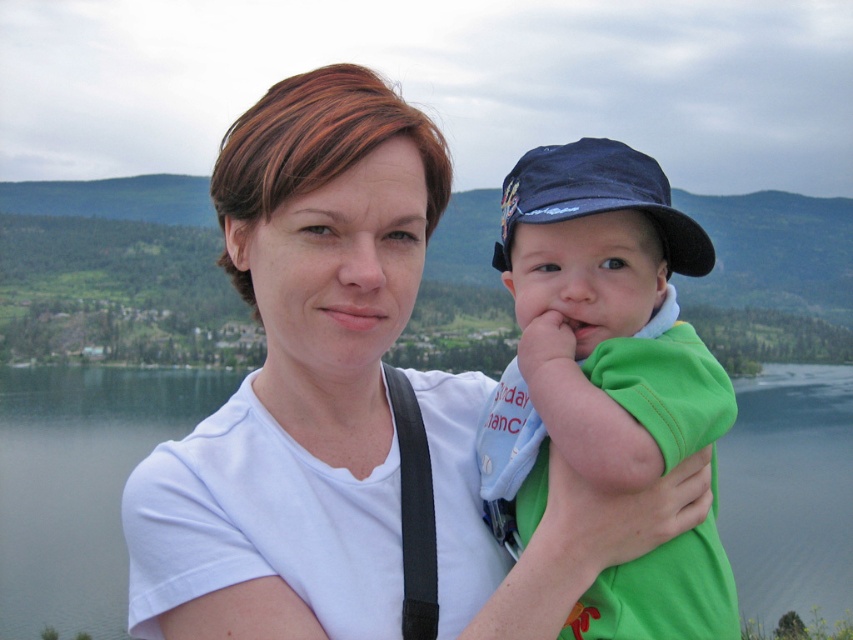
You are organizing a clothing donation drive and need to sort shirts by size. You have a white cotton shirt at center and a green cotton shirt at center. Which shirt should you place in the large size bin?

The white cotton shirt at center should be placed in the large size bin because it is bigger than the green cotton shirt at center.

You are a photographer trying to capture a clear shot of the dark blue fabric baseball cap at center without the transparent water at center obstructing the view. Is this possible given their positions?

The dark blue fabric baseball cap at center is behind transparent water at center, so it might still be visible but could appear slightly blurred or distorted through the water.

You are planning to take a photo of the transparent water at center and the dark blue fabric baseball cap at center. Which object should you focus on first if you want to capture both in the same frame without moving the camera?

The transparent water at center should be focused on first because it is wider than the dark blue fabric baseball cap at center, ensuring it fits properly in the frame.